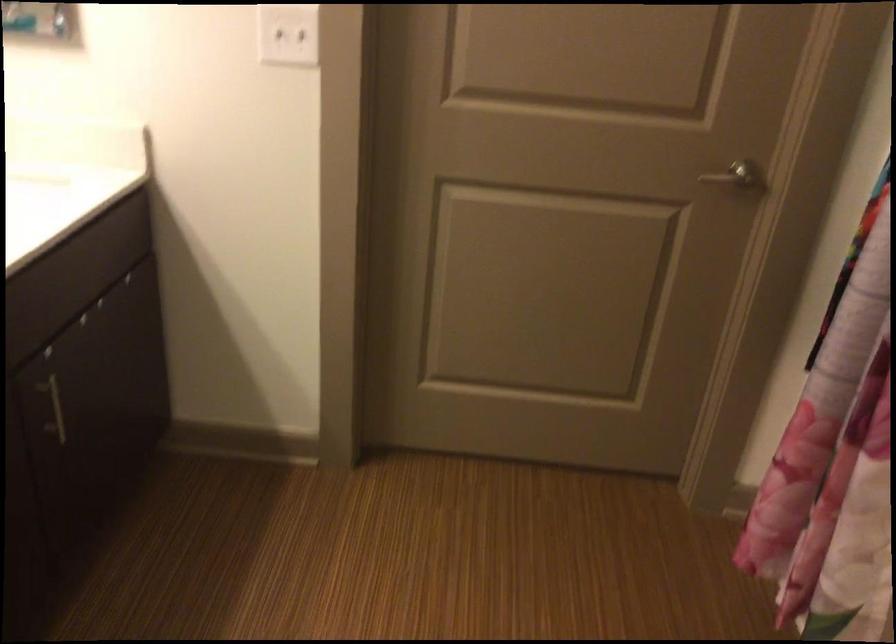
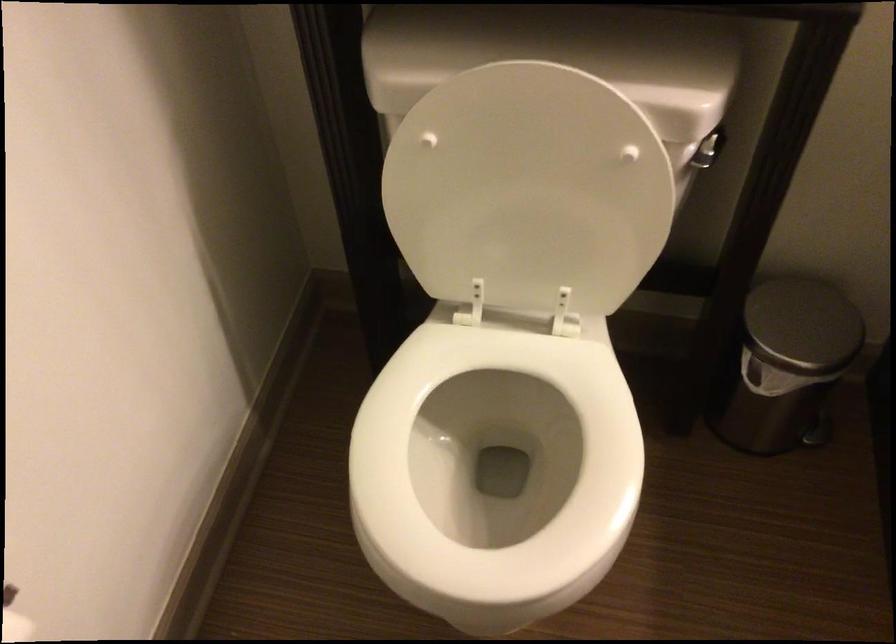
Based on the continuous images, in which direction is the camera rotating?

The rotation direction of the camera is left-down.